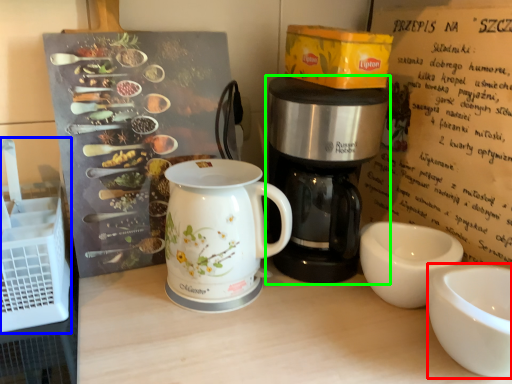
Question: Estimate the real-world distances between objects in this image. Which object is farther from coffee cup (highlighted by a red box), crate (highlighted by a blue box) or coffee maker (highlighted by a green box)?

Choices:
 (A) crate
 (B) coffee maker

Answer: (A)